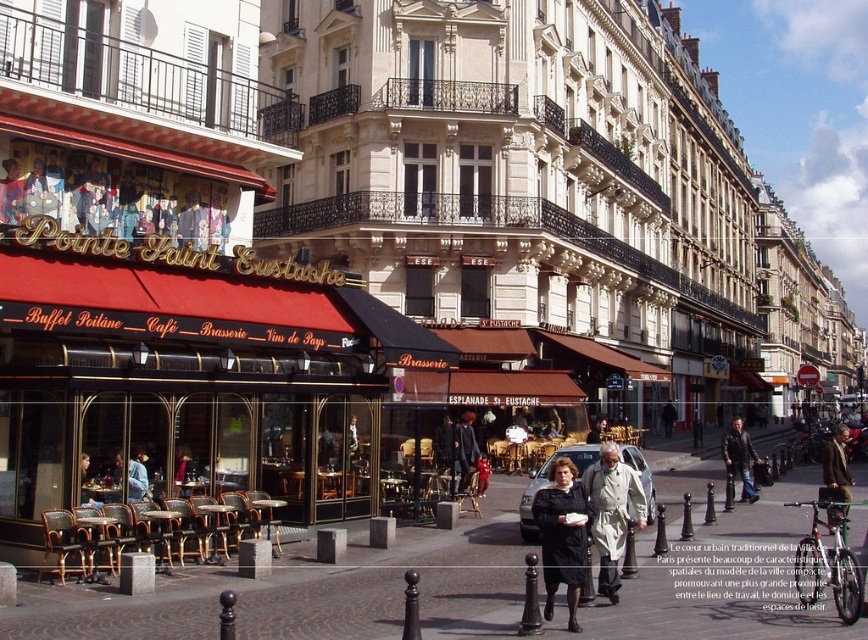
You are standing at the camera position and want to pick up the light beige trench coat at center. Can you reach it without moving?

The light beige trench coat at center is 38.81 meters away from camera, so you cannot reach it without moving.

You are standing in front of the Pointe Saint Eustache cafe and want to take a photo of two specific points marked on the awning. The first point is at coordinates point (610, 577) and the second is at point (94, 499). Which point will appear larger in your photo?

Point (610, 577) is closer to the camera than point (94, 499), so it will appear larger in the photo.